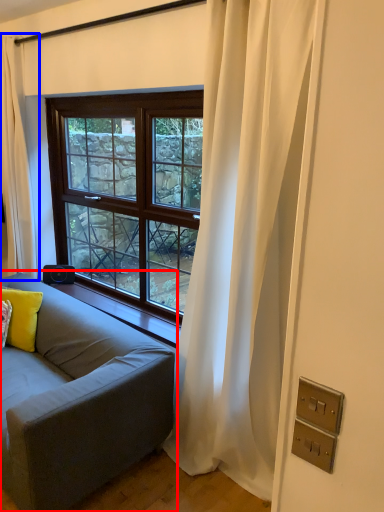
Question: Which object is further to the camera taking this photo, studio couch (highlighted by a red box) or curtain (highlighted by a blue box)?

Choices:
 (A) studio couch
 (B) curtain

Answer: (B)